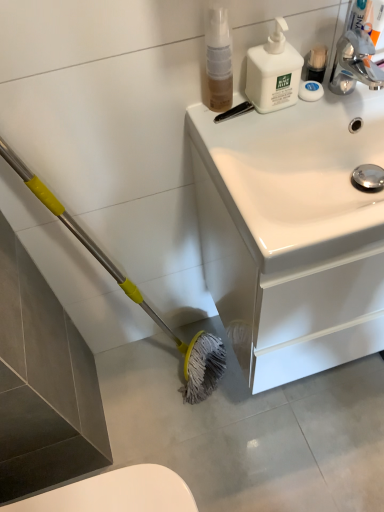
The height and width of the screenshot is (512, 384). Identify the location of free space to the left of white matte soap at upper right. (247, 119).